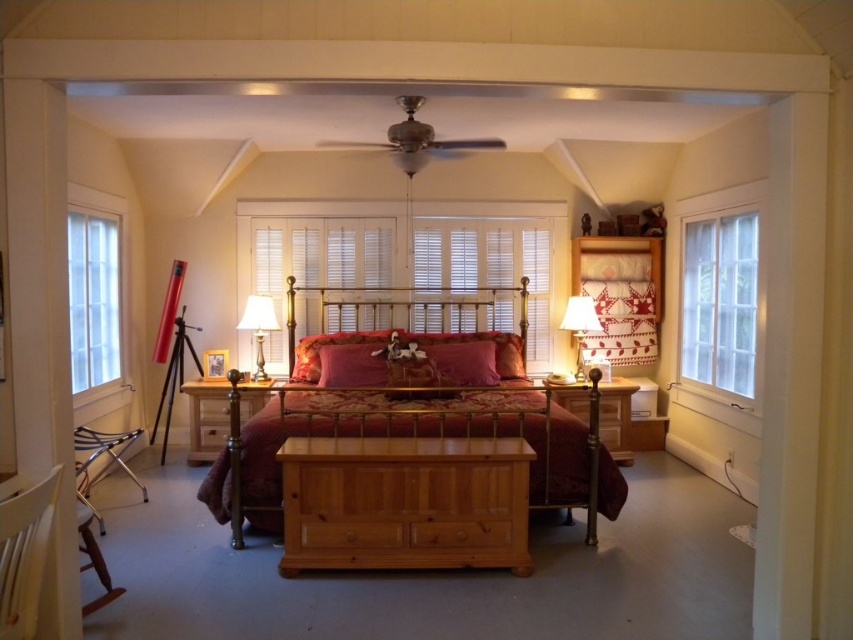
You are standing in the bedroom described in the scene. There is a point marked at coordinates (351, 365). What object is located at that point?

The point at coordinates (351, 365) marks the location of the velvet red pillow at center.

You are standing in the bedroom and want to look outside through the clear glass window at right. To do this, do you need to move away from the metallic gold headboard at center?

The clear glass window at right is in front of the metallic gold headboard at center, so you can look outside through the clear glass window at right without needing to move away from the metallic gold headboard at center.

You are standing in the bedroom and want to know how far the point at coordinates (730, 280) is from your current position. Can you determine the distance?

The point at coordinates (730, 280) is 15.55 feet away from the camera, so the distance from your current position to that point is 15.55 feet.